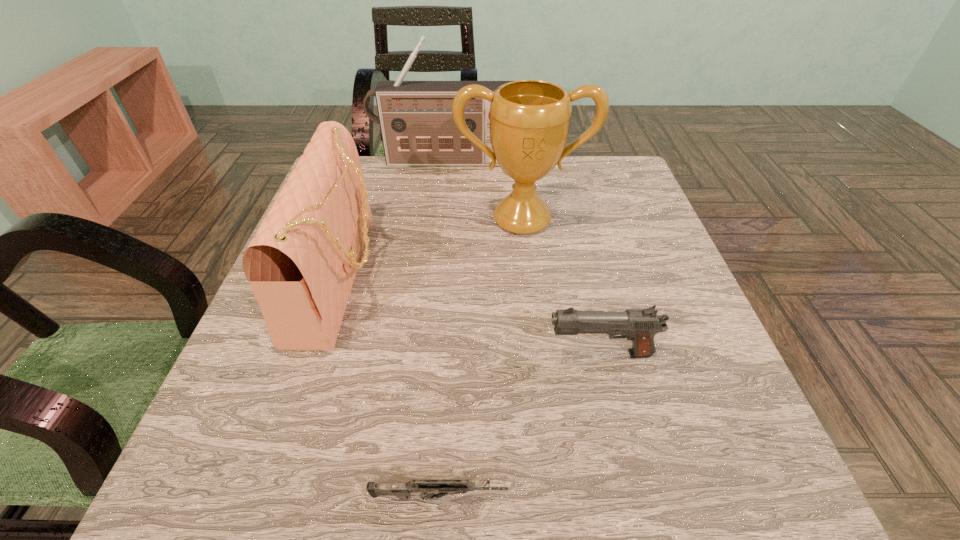
I want to click on radio receiver, so click(x=417, y=127).

Locate an element on the screen. This screenshot has width=960, height=540. award is located at coordinates (529, 119).

The image size is (960, 540). Identify the location of handbag. (301, 265).

Find the location of a particular element. Image resolution: width=960 pixels, height=540 pixels. the fourth tallest object is located at coordinates (640, 325).

Where is `the right gun`? This screenshot has height=540, width=960. the right gun is located at coordinates (640, 325).

At what (x,y) coordinates should I click in order to perform the action: click on the shorter gun. Please return your answer as a coordinate pair (x, y). Looking at the image, I should click on (443, 487).

Locate an element on the screen. The height and width of the screenshot is (540, 960). the nearest object is located at coordinates (443, 487).

This screenshot has height=540, width=960. I want to click on vacant region located 0.070m on the front panel of the farthest object, so click(x=441, y=183).

Where is `vacant space located 0.110m on the front of the award with the decoration`? vacant space located 0.110m on the front of the award with the decoration is located at coordinates (528, 275).

The image size is (960, 540). In order to click on free space located on the front-facing side of the handbag in this screenshot , I will do `click(567, 275)`.